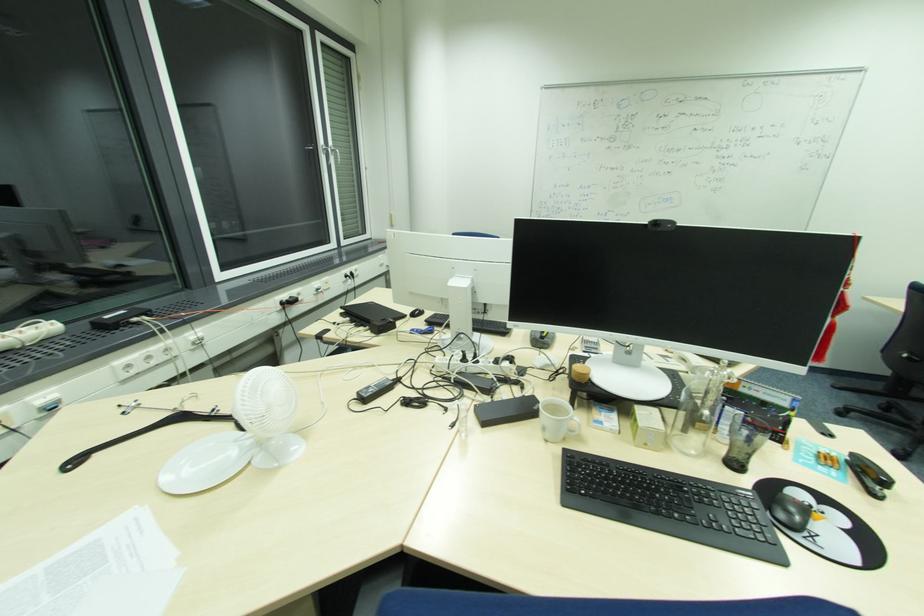
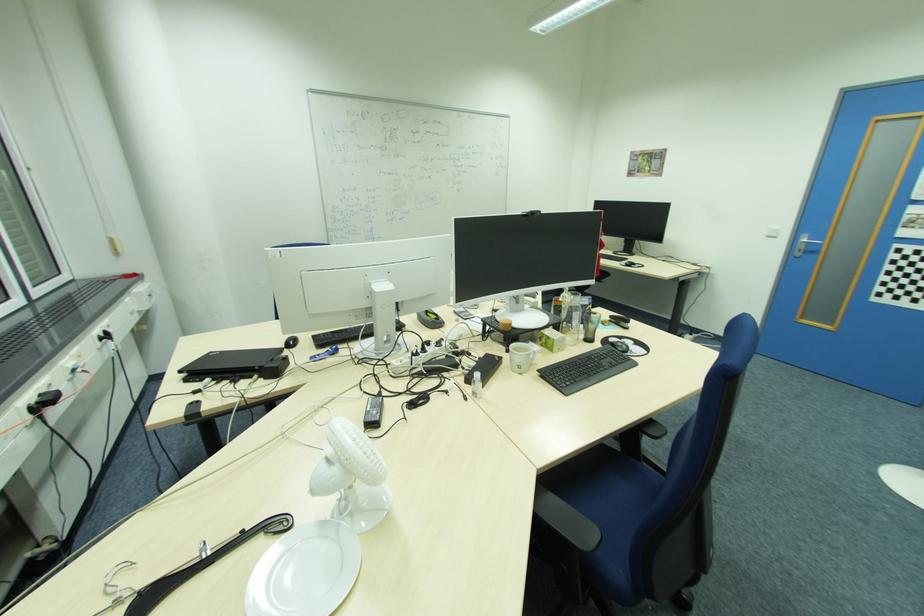
Locate, in the second image, the point that corresponds to pixel 247 391 in the first image.

(360, 444)